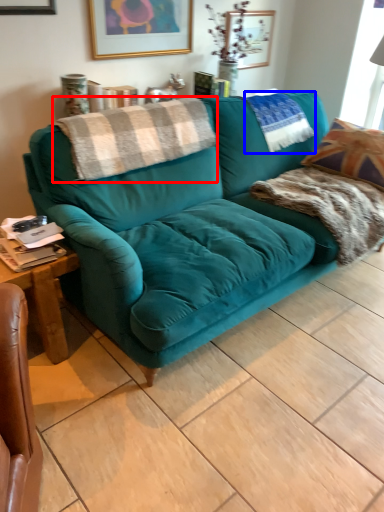
Question: Which object is closer to the camera taking this photo, blanket (highlighted by a red box) or pillow (highlighted by a blue box)?

Choices:
 (A) blanket
 (B) pillow

Answer: (A)